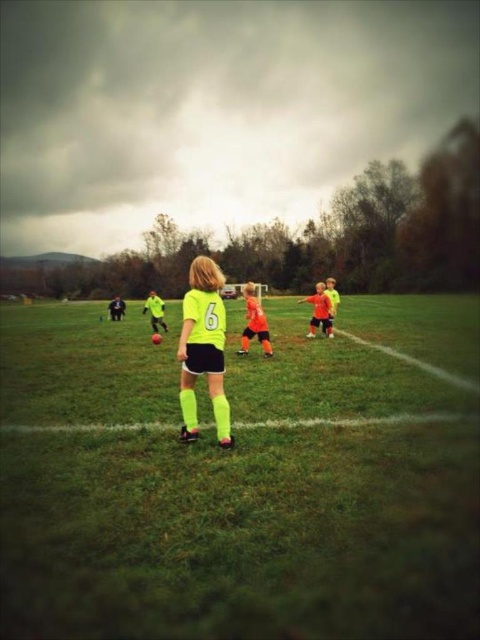
Question: Among these objects, which one is farthest from the camera?

Choices:
 (A) neon yellow socks at lower center
 (B) neon green jersey at center
 (C) orange matte soccer jersey at center
 (D) orange jersey at center

Answer: (D)

Question: Is neon yellow socks at lower center to the right of orange jersey at center from the viewer's perspective?

Choices:
 (A) yes
 (B) no

Answer: (B)

Question: Among these objects, which one is farthest from the camera?

Choices:
 (A) orange jersey at center
 (B) neon green jersey at center

Answer: (A)

Question: Which of the following is the farthest from the observer?

Choices:
 (A) orange matte soccer jersey at center
 (B) neon yellow socks at lower center

Answer: (A)

Question: Can you confirm if neon green jersey at center is positioned below neon yellow jersey at center?

Choices:
 (A) yes
 (B) no

Answer: (A)

Question: Does neon yellow jersey at center appear over orange jersey at center?

Choices:
 (A) yes
 (B) no

Answer: (B)